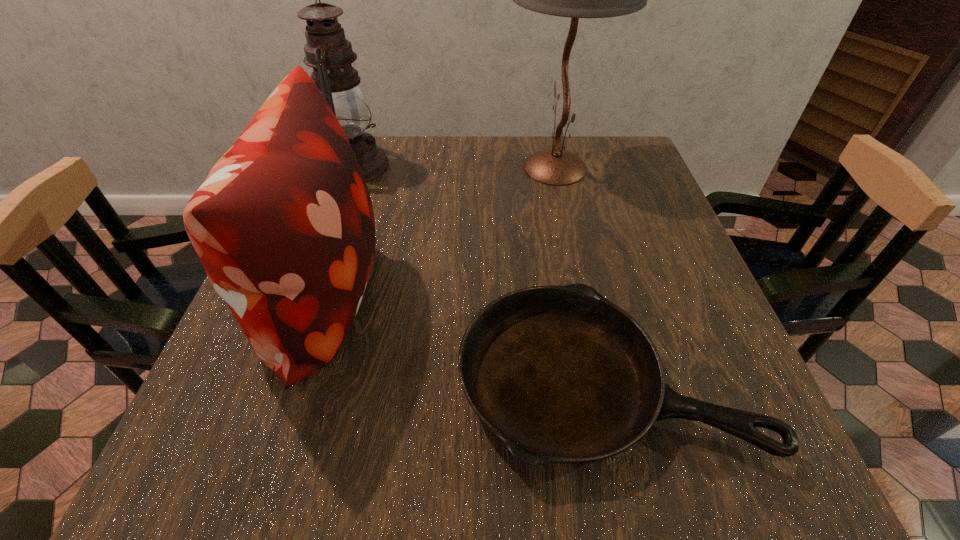
You are a GUI agent. You are given a task and a screenshot of the screen. Output one action in this format:
    pyautogui.click(x=<x>, y=<y>)
    Task: Click on the vacant space at the far edge of the desktop
    
    Given the screenshot: What is the action you would take?
    pyautogui.click(x=422, y=156)

In the image, there is a desktop. Where is `free region at the left edge`? The width and height of the screenshot is (960, 540). free region at the left edge is located at coordinates (223, 363).

This screenshot has width=960, height=540. In the image, there is a desktop. In order to click on vacant space at the right edge in this screenshot , I will do `click(653, 309)`.

Find the location of a particular element. free space at the far right corner of the desktop is located at coordinates (622, 155).

I want to click on free space that is in between the cushion and the frying pan, so click(462, 339).

Image resolution: width=960 pixels, height=540 pixels. Identify the location of vacant region between the cushion and the tallest object. (438, 233).

The image size is (960, 540). In order to click on vacant point located between the tallest object and the cushion in this screenshot , I will do `click(438, 233)`.

Find the location of a particular element. The image size is (960, 540). unoccupied position between the oil lamp and the shortest object is located at coordinates (479, 273).

I want to click on free space between the oil lamp and the frying pan, so click(x=479, y=273).

Locate an element on the screen. This screenshot has width=960, height=540. free spot between the shortest object and the oil lamp is located at coordinates (479, 273).